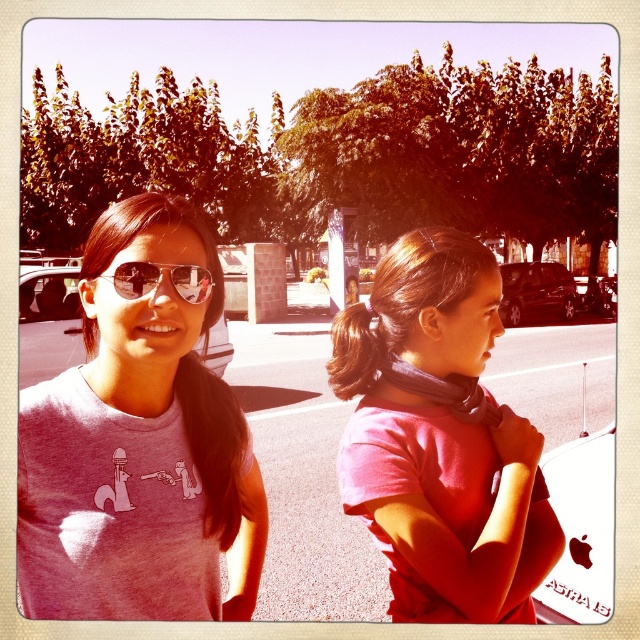
Question: Does pink matte scarf at center come in front of matte black sunglasses at upper left?

Choices:
 (A) no
 (B) yes

Answer: (A)

Question: Can you confirm if pink cotton t-shirt at center is positioned below matte black sunglasses at upper left?

Choices:
 (A) no
 (B) yes

Answer: (B)

Question: Which point is farther to the camera?

Choices:
 (A) (408, 252)
 (B) (93, 520)
 (C) (154, 282)

Answer: (A)

Question: Which object is closer to the camera taking this photo?

Choices:
 (A) pink cotton t-shirt at center
 (B) pink matte scarf at center
 (C) matte black sunglasses at upper left

Answer: (A)

Question: Which point appears farthest from the camera in this image?

Choices:
 (A) (140, 268)
 (B) (88, 548)
 (C) (433, 492)

Answer: (C)

Question: Can you confirm if pink cotton t-shirt at center is positioned below matte black sunglasses at upper left?

Choices:
 (A) yes
 (B) no

Answer: (A)